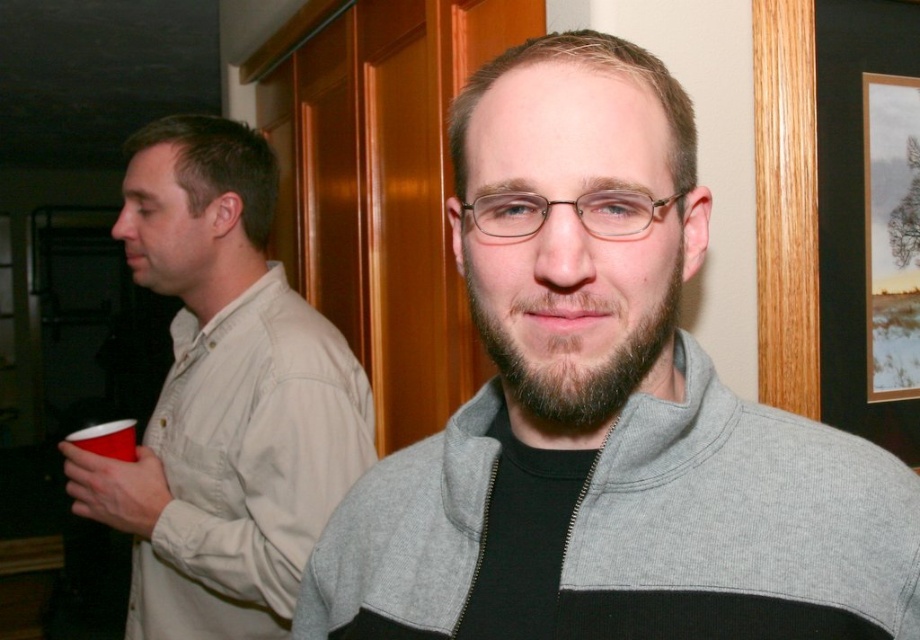
You are at a party and want to take a photo of the brown fuzzy beard at center without the wooden picture frame at right blocking the view. Where should you move to achieve this?

Move to the left side of the wooden picture frame at right so that the brown fuzzy beard at center is no longer obstructed by the frame.

You are at a party and want to place a small note on the wooden picture frame at right. The note is 10 cm tall. Can you fit it there without covering the red plastic cup at lower left?

The wooden picture frame at right is above the red plastic cup at lower left, so placing a 10 cm tall note on the wooden picture frame at right would not cover the red plastic cup at lower left since they are vertically separated.